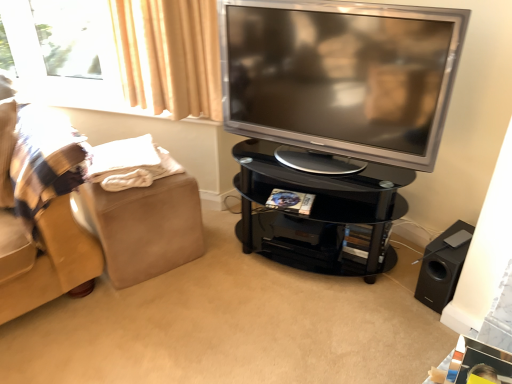
This screenshot has width=512, height=384. I want to click on vacant region above black glossy tv stand at center (from a real-world perspective), so click(231, 303).